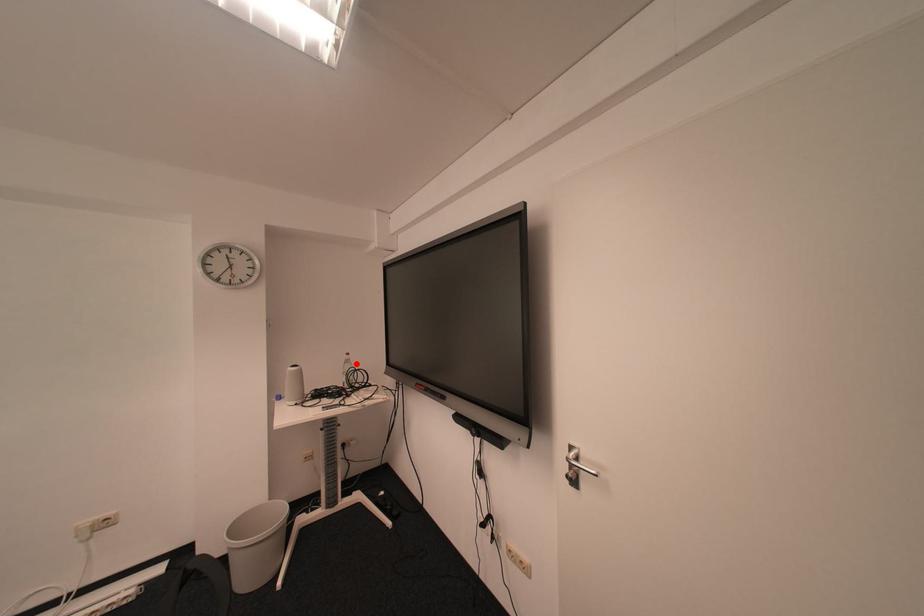
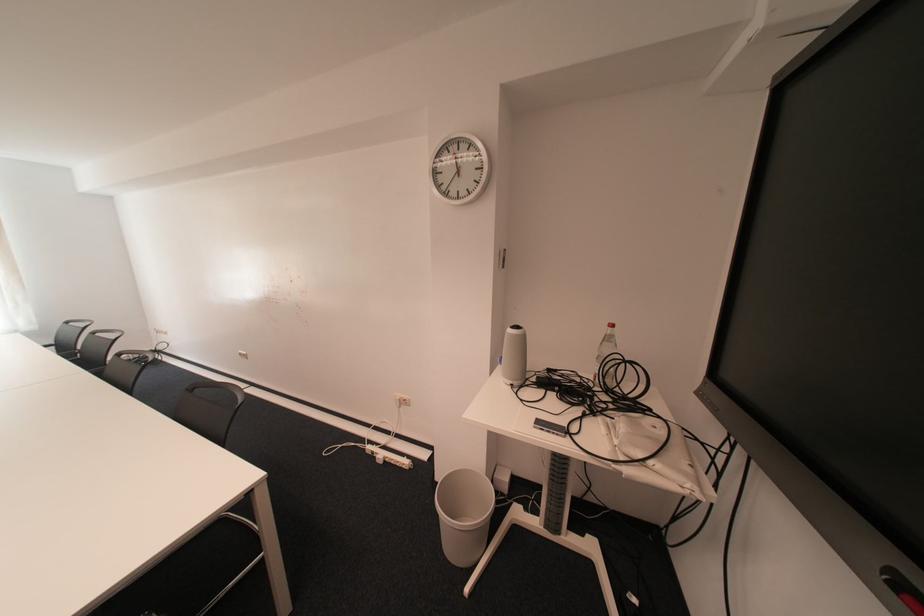
The point at the highlighted location is marked in the first image. Where is the corresponding point in the second image?

(614, 341)